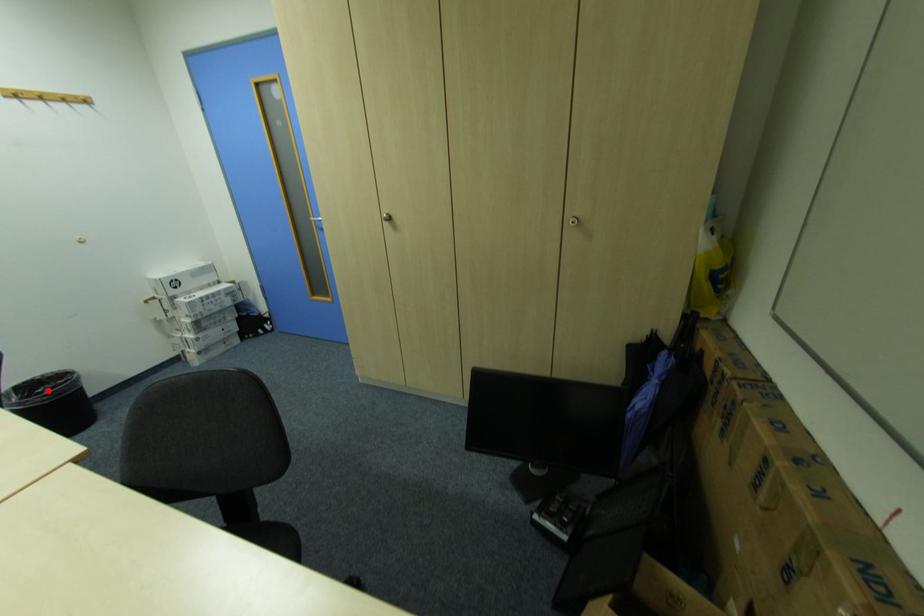
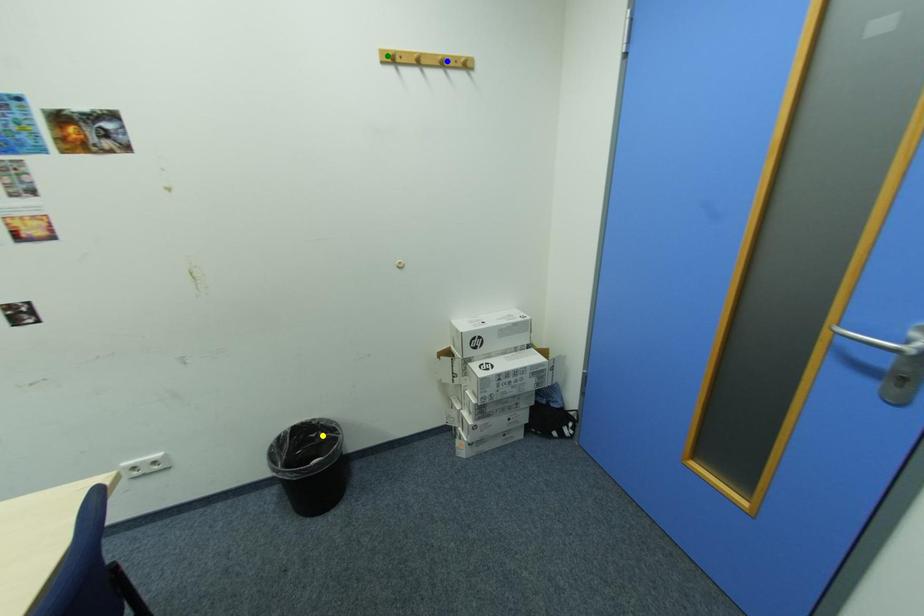
Question: I am providing you with two images of the same scene from different viewpoints. A red point is marked on the first image. You are given multiple points on the second image. Can you choose the point in image 2 that corresponds to the point in image 1?

Choices:
 (A) yellow point
 (B) blue point
 (C) green point

Answer: (A)